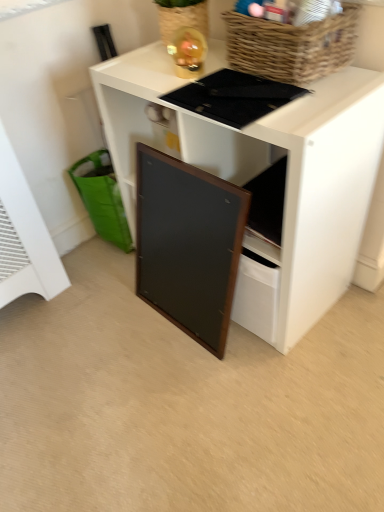
The width and height of the screenshot is (384, 512). I want to click on free space above black matte board at center (from a real-world perspective), so click(x=223, y=80).